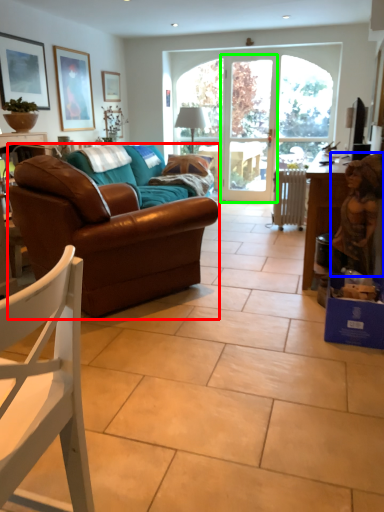
Question: Which object is the closest to the studio couch (highlighted by a red box)? Choose among these: person (highlighted by a blue box) or screen door (highlighted by a green box).

Choices:
 (A) person
 (B) screen door

Answer: (A)